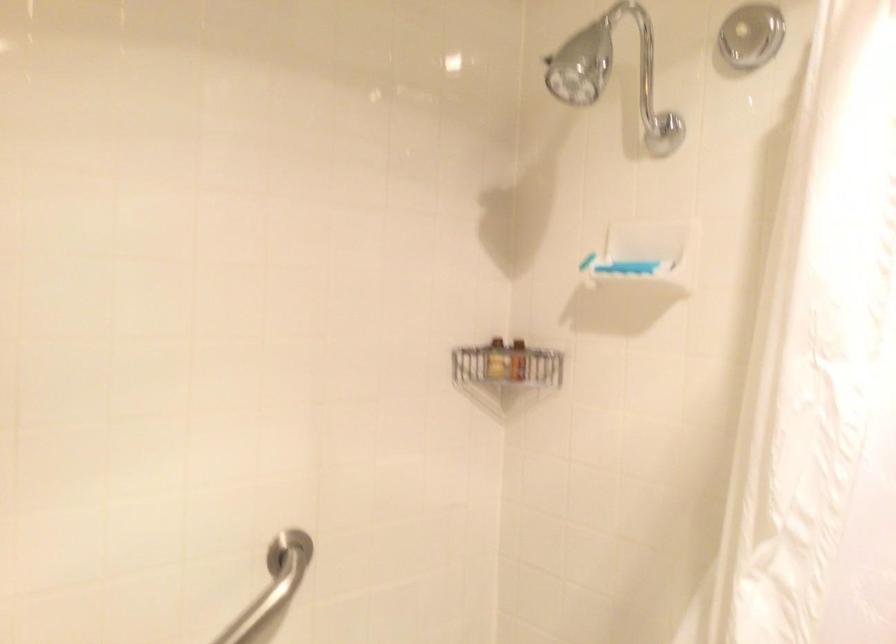
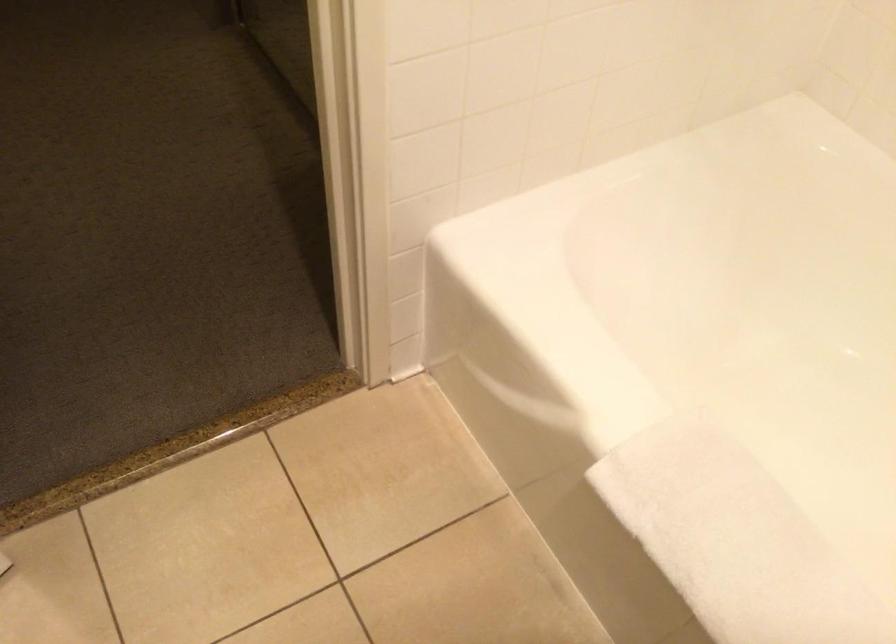
From the picture: First-person continuous shooting, in which direction is the camera rotating?

The camera rotated toward left-down.